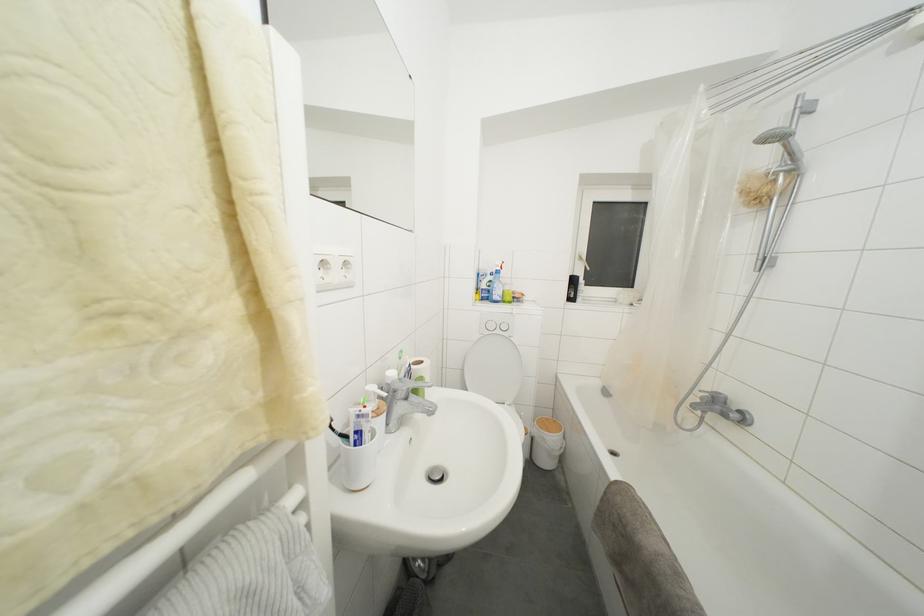
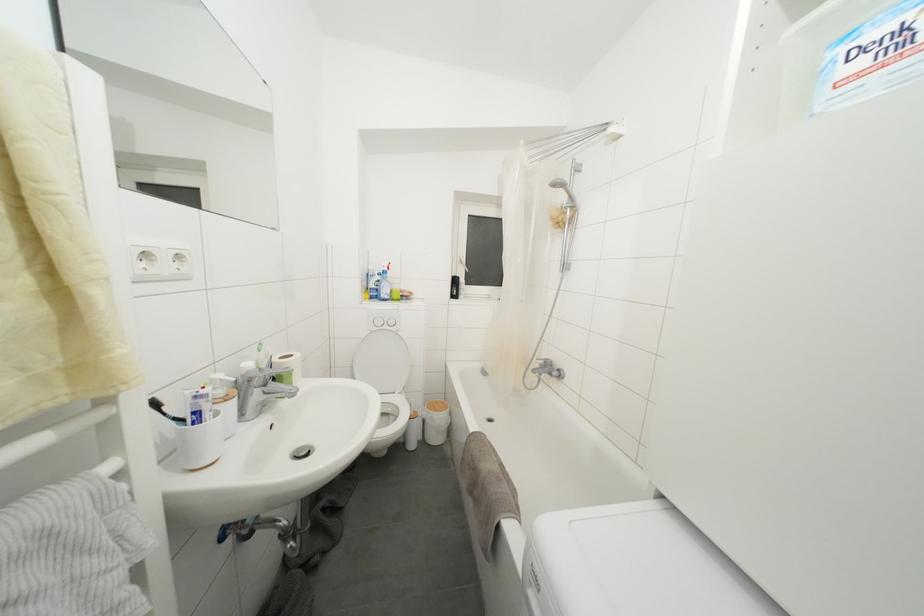
Where in the second image is the point corresponding to point 362,421 from the first image?

(200, 402)